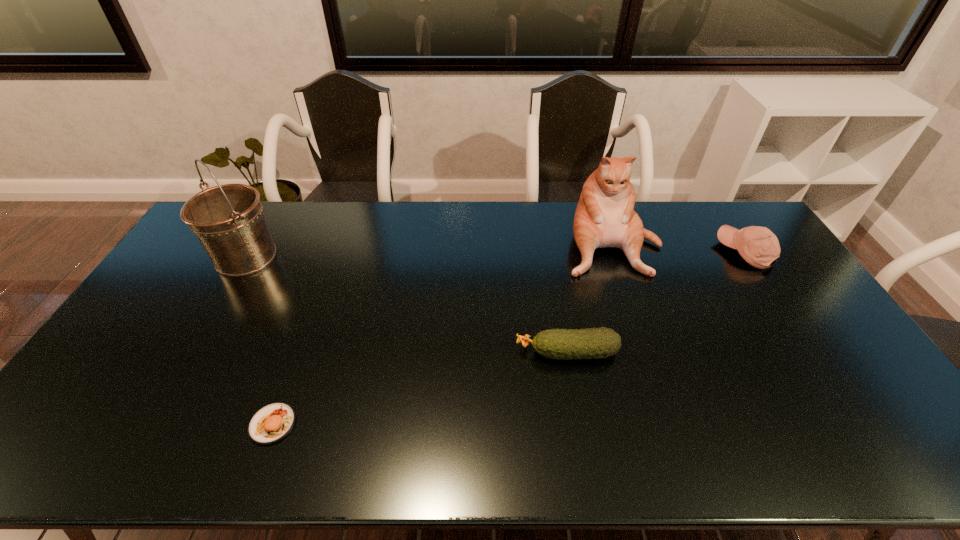
This screenshot has width=960, height=540. I want to click on object that is at the near edge, so click(271, 423).

You are a GUI agent. You are given a task and a screenshot of the screen. Output one action in this format:
    pyautogui.click(x=<x>, y=<y>)
    Task: Click on the object that is at the left edge
    
    Given the screenshot: What is the action you would take?
    (228, 220)

Locate an element on the screen. This screenshot has height=540, width=960. object located at the right edge is located at coordinates (758, 246).

Find the location of a particular element. This screenshot has height=540, width=960. object at the far left corner is located at coordinates (228, 220).

The image size is (960, 540). Find the location of `object at the far right corner`. object at the far right corner is located at coordinates (758, 246).

The height and width of the screenshot is (540, 960). In order to click on vacant space at the far edge of the desktop in this screenshot , I will do `click(468, 211)`.

The width and height of the screenshot is (960, 540). Identify the location of vacant space at the near edge of the desktop. (312, 457).

Where is `vacant area at the left edge of the desktop`? vacant area at the left edge of the desktop is located at coordinates (140, 378).

Image resolution: width=960 pixels, height=540 pixels. In order to click on free space at the far right corner of the desktop in this screenshot , I will do `click(718, 211)`.

Where is `free space between the rightmost object and the nearest object`? This screenshot has width=960, height=540. free space between the rightmost object and the nearest object is located at coordinates (509, 338).